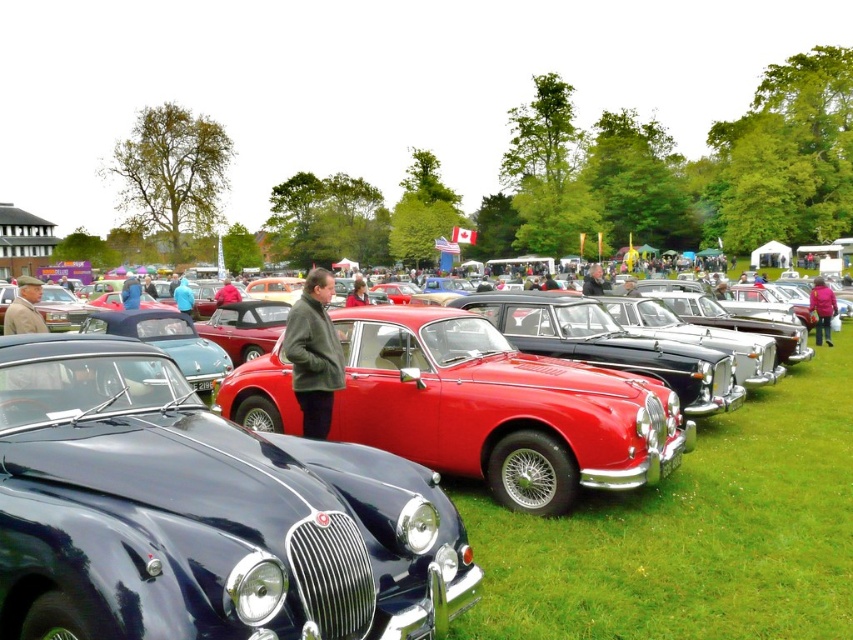
Question: Which object is farther from the camera taking this photo?

Choices:
 (A) shiny red car at center
 (B) green wool coat at center
 (C) blue fabric jacket at center
 (D) glossy black car at center

Answer: (C)

Question: Considering the relative positions of glossy black car at center and blue fabric jacket at center in the image provided, where is glossy black car at center located with respect to blue fabric jacket at center?

Choices:
 (A) below
 (B) above

Answer: (A)

Question: Which point is closer to the camera?

Choices:
 (A) shiny red car at center
 (B) blue fabric jacket at center

Answer: (A)

Question: Does glossy black car at center appear under blue fabric jacket at center?

Choices:
 (A) no
 (B) yes

Answer: (B)

Question: Does green wool coat at center have a lesser width compared to blue fabric jacket at center?

Choices:
 (A) yes
 (B) no

Answer: (A)

Question: Which is nearer to the green wool coat at center?

Choices:
 (A) pink fabric jacket at center
 (B) shiny red car at center
 (C) glossy black car at center
 (D) blue fabric jacket at center

Answer: (C)